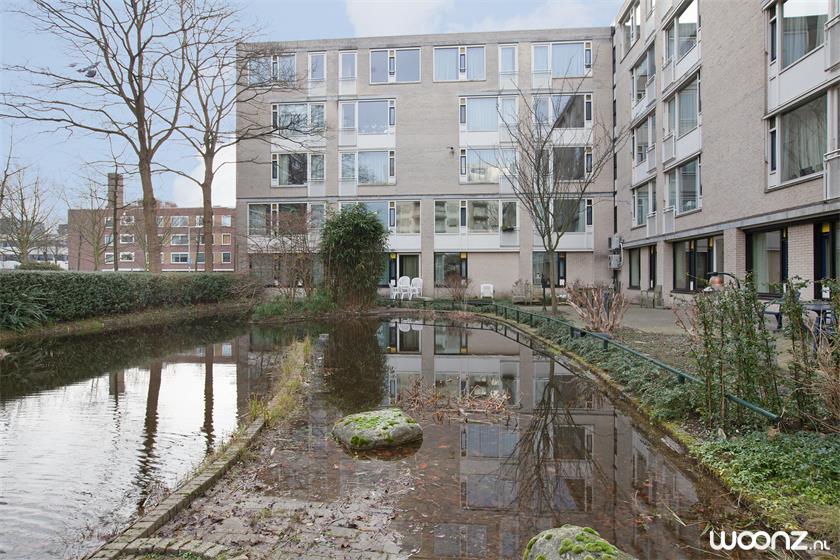
You are a GUI agent. You are given a task and a screenshot of the screen. Output one action in this format:
    pyautogui.click(x=<x>, y=<y>)
    Task: Click on the white chair
    
    Given the screenshot: What is the action you would take?
    pyautogui.click(x=392, y=292), pyautogui.click(x=405, y=292), pyautogui.click(x=413, y=295), pyautogui.click(x=418, y=284), pyautogui.click(x=405, y=280), pyautogui.click(x=487, y=292)